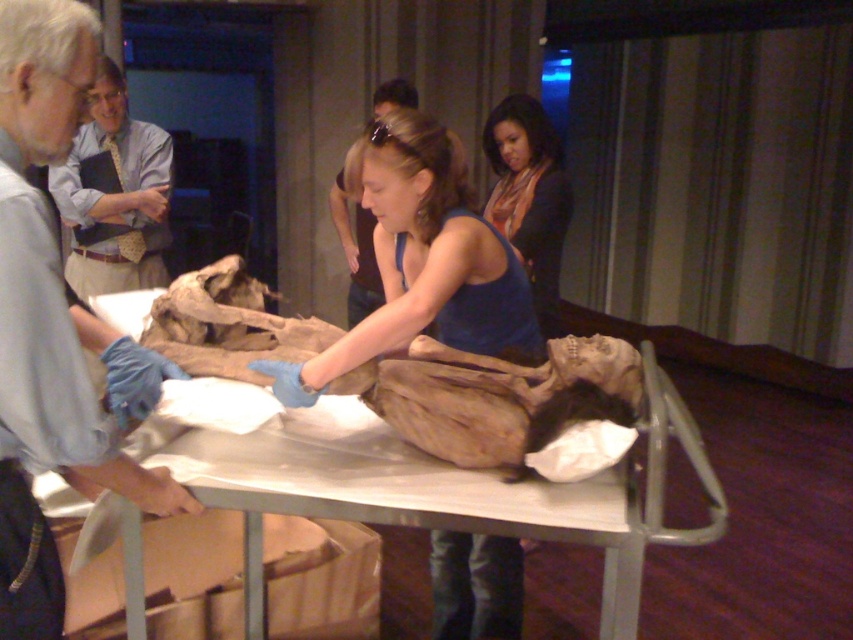
You are an assistant at the museum and need to determine which clothing item is more suitable for a display label. The blue fabric shirt at center and the matte blue tank top at center are both present in the scene. Which one has a larger size?

The blue fabric shirt at center has a larger size compared to the matte blue tank top at center, so it is the more suitable item for the display label if size is a consideration.